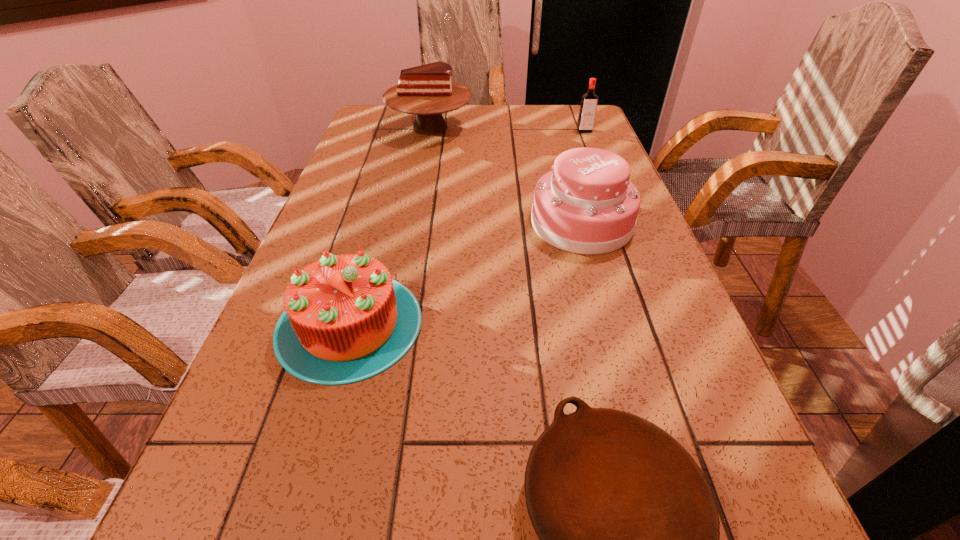
Locate an element on the screen. the farthest cake is located at coordinates (427, 90).

At what (x,y) coordinates should I click in order to perform the action: click on vodka. Please return your answer as a coordinate pair (x, y). The width and height of the screenshot is (960, 540). Looking at the image, I should click on (589, 101).

Locate an element on the screen. the second farthest cake is located at coordinates (586, 205).

Find the location of a particular element. the third farthest object is located at coordinates (586, 205).

Locate an element on the screen. the fourth farthest object is located at coordinates (345, 320).

You are a GUI agent. You are given a task and a screenshot of the screen. Output one action in this format:
    pyautogui.click(x=<x>, y=<y>)
    Task: Click on the free space located 0.220m on the right of the farthest cake
    
    Given the screenshot: What is the action you would take?
    point(540,127)

The width and height of the screenshot is (960, 540). Identify the location of vacant space located on the front and back of the vodka. (611, 198).

Image resolution: width=960 pixels, height=540 pixels. What are the coordinates of `free location located 0.350m on the back of the third nearest object` in the screenshot? It's located at (557, 136).

This screenshot has height=540, width=960. What are the coordinates of `free space located on the right of the fourth farthest object` in the screenshot? It's located at (563, 323).

Find the location of a particular element. The image size is (960, 540). cake that is at the far edge is located at coordinates (427, 90).